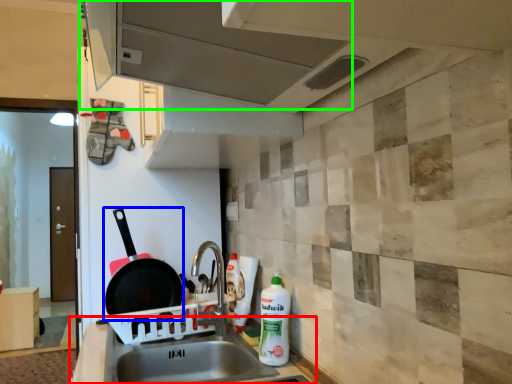
Question: Which object is the closest to the counter top (highlighted by a red box)? Choose among these: frying pan (highlighted by a blue box) or exhaust hood (highlighted by a green box).

Choices:
 (A) frying pan
 (B) exhaust hood

Answer: (A)